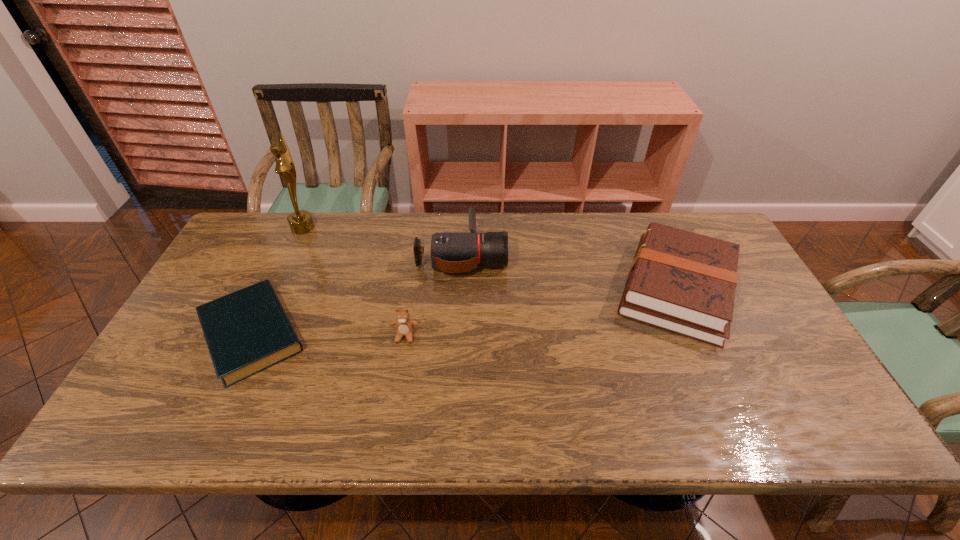
Image resolution: width=960 pixels, height=540 pixels. What are the coordinates of `free region at the far edge of the desktop` in the screenshot? It's located at (374, 244).

At what (x,y) coordinates should I click in order to perform the action: click on blank area at the right edge. Please return your answer as a coordinate pair (x, y). The height and width of the screenshot is (540, 960). Looking at the image, I should click on point(747,321).

In the image, there is a desktop. Identify the location of free space at the far left corner. (277, 215).

Identify the location of vacant space at the near left corner. This screenshot has height=540, width=960. (140, 415).

The image size is (960, 540). Find the location of `vacant space at the far right corner of the desktop`. vacant space at the far right corner of the desktop is located at coordinates (710, 235).

The width and height of the screenshot is (960, 540). What are the coordinates of `free area in between the camcorder and the tallest object` in the screenshot? It's located at (382, 241).

You are a GUI agent. You are given a task and a screenshot of the screen. Output one action in this format:
    pyautogui.click(x=<x>, y=<y>)
    Task: Click on the empty space that is in between the rightmost object and the teddy bear
    
    Given the screenshot: What is the action you would take?
    pyautogui.click(x=540, y=312)

Find the location of a particular element. The width and height of the screenshot is (960, 540). vacant space that's between the camcorder and the teddy bear is located at coordinates [434, 295].

This screenshot has width=960, height=540. I want to click on vacant area that lies between the shortest object and the taller book, so click(464, 312).

In order to click on vacant space that's between the tallest object and the camcorder in this screenshot , I will do `click(382, 241)`.